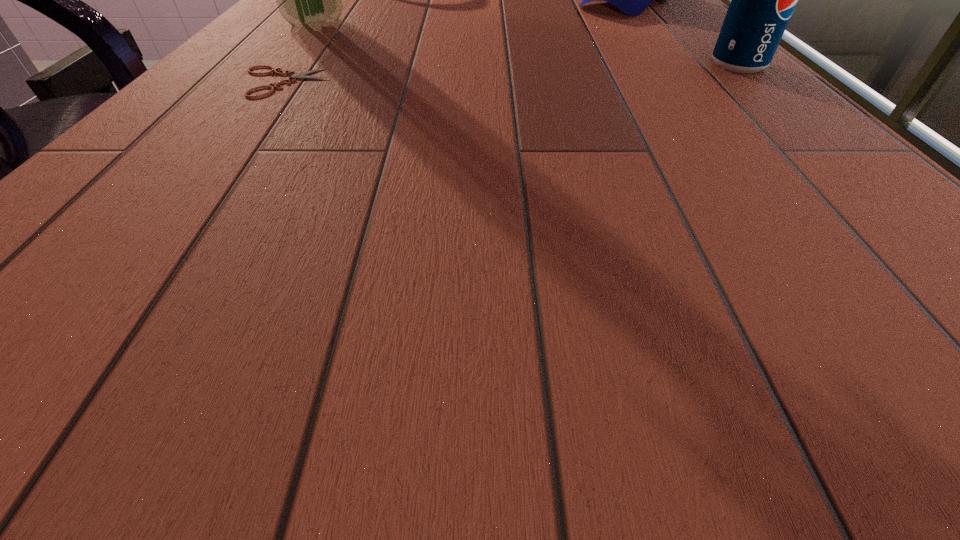
Where is `object situated at the right edge`? Image resolution: width=960 pixels, height=540 pixels. object situated at the right edge is located at coordinates (762, 0).

This screenshot has height=540, width=960. In order to click on free space at the near edge of the desktop in this screenshot , I will do `click(237, 225)`.

Image resolution: width=960 pixels, height=540 pixels. In order to click on vacant space at the left edge of the desktop in this screenshot , I will do `click(318, 30)`.

I want to click on free spot at the right edge of the desktop, so click(x=732, y=78).

This screenshot has height=540, width=960. I want to click on vacant position at the near left corner of the desktop, so click(197, 230).

Find the location of `vacant position at the near right corner of the desktop`. vacant position at the near right corner of the desktop is located at coordinates (866, 234).

At what (x,y) coordinates should I click in order to perform the action: click on free space between the shortest object and the tallest object. Please return your answer as a coordinate pair (x, y). This screenshot has height=540, width=960. Looking at the image, I should click on (299, 52).

Locate an element on the screen. vacant area that lies between the tallest object and the shears is located at coordinates (299, 52).

At what (x,y) coordinates should I click in order to perform the action: click on empty location between the third shortest object and the tallest object. Please return your answer as a coordinate pair (x, y). Looking at the image, I should click on (526, 44).

You are a GUI agent. You are given a task and a screenshot of the screen. Output one action in this format:
    pyautogui.click(x=<x>, y=<y>)
    Task: Click on the object that stands as the closest to the shears
    Image resolution: width=960 pixels, height=540 pixels.
    Given the screenshot: What is the action you would take?
    pyautogui.click(x=309, y=0)